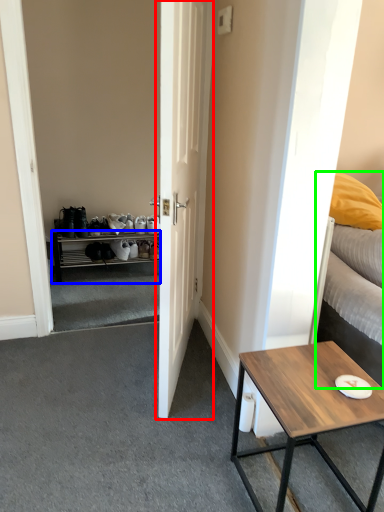
Question: Which is farther away from door (highlighted by a red box)? cabinetry (highlighted by a blue box) or bed (highlighted by a green box)?

Choices:
 (A) cabinetry
 (B) bed

Answer: (A)